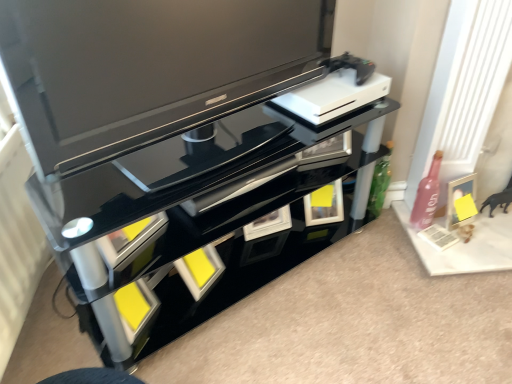
The width and height of the screenshot is (512, 384). Find the location of `vacant space to the right of pink glass bottle at right`. vacant space to the right of pink glass bottle at right is located at coordinates (489, 237).